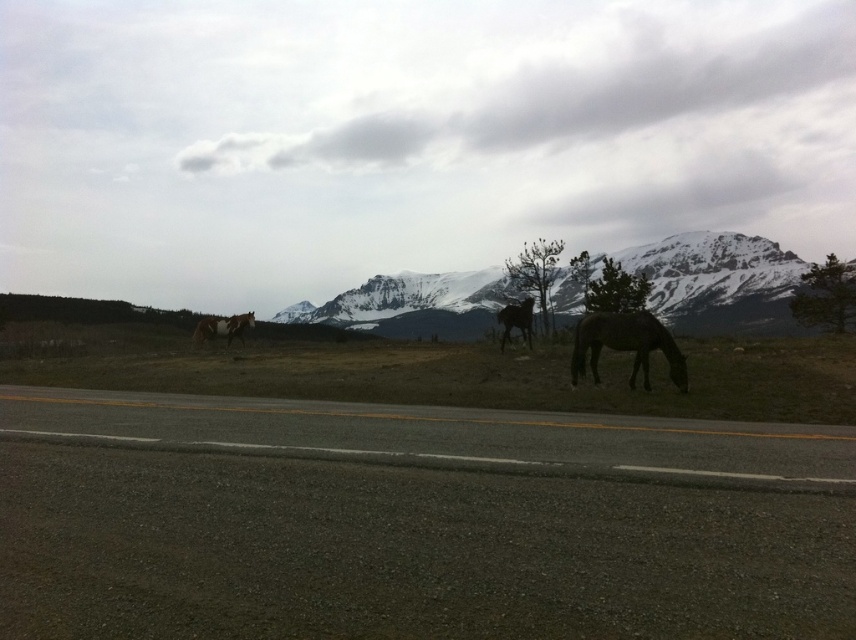
Question: Which is farther from the brown matte horse at right?

Choices:
 (A) asphalt road at center
 (B) green grass at center
 (C) brown glossy horse at left
 (D) snowy granite mountain at center

Answer: (D)

Question: Is gray asphalt highway at lower center to the left of brown glossy horse at center from the viewer's perspective?

Choices:
 (A) no
 (B) yes

Answer: (B)

Question: Does asphalt road at center have a larger size compared to snowy granite mountain at center?

Choices:
 (A) no
 (B) yes

Answer: (A)

Question: Can you confirm if gray asphalt highway at lower center is positioned above brown glossy horse at center?

Choices:
 (A) yes
 (B) no

Answer: (B)

Question: Which point is farther to the camera?

Choices:
 (A) (531, 326)
 (B) (15, 387)
 (C) (559, 440)

Answer: (A)

Question: Considering the real-world distances, which object is farthest from the asphalt road at center?

Choices:
 (A) brown matte horse at right
 (B) snowy granite mountain at center

Answer: (B)